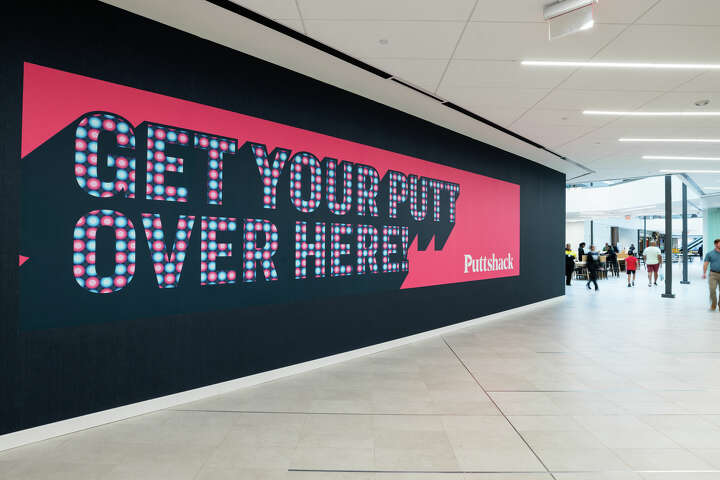
Locate an element on the screen. This screenshot has width=720, height=480. vent is located at coordinates (577, 15).